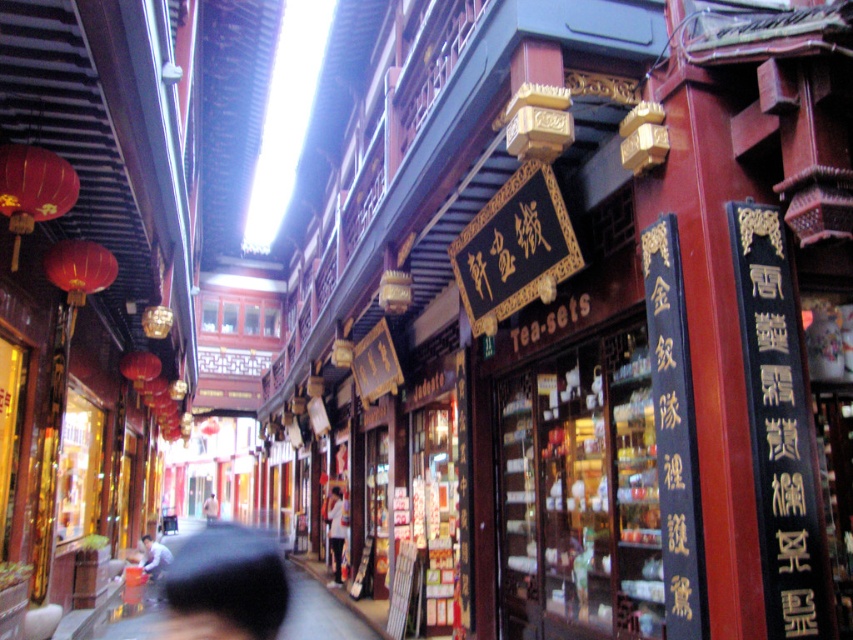
You are a tourist walking down this traditional Chinese street and notice a dark gray fabric umbrella at lower center and a white matte shirt at center. Which object is positioned more to the left?

The dark gray fabric umbrella at lower center is positioned more to the left than the white matte shirt at center.